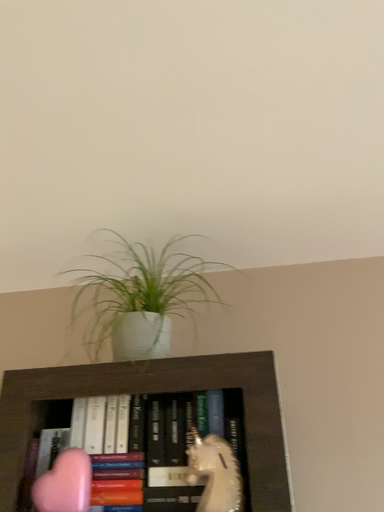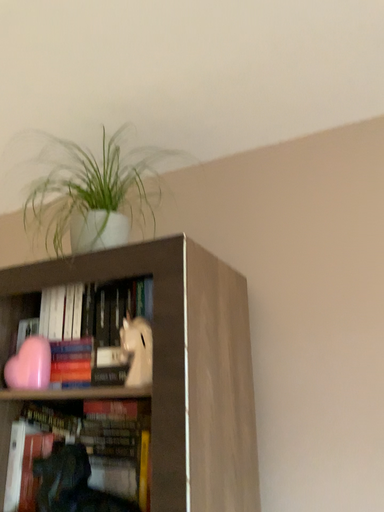
Question: How did the camera likely rotate when shooting the video?

Choices:
 (A) rotated left
 (B) rotated right

Answer: (A)